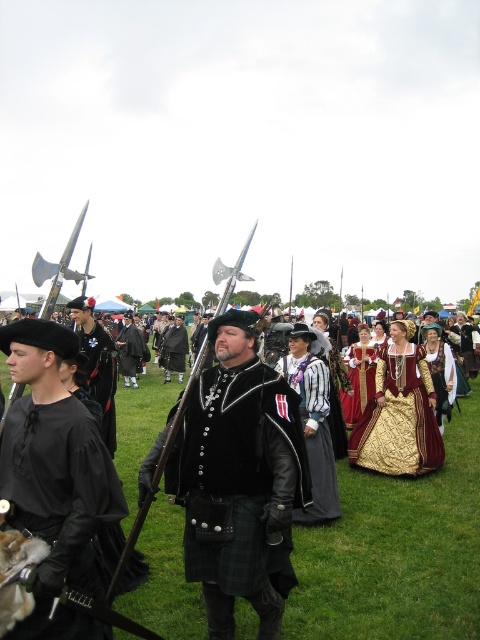
Is the position of striped fabric dress at center less distant than that of gold brocade dress at center?

Yes, it is.

Can you confirm if striped fabric dress at center is positioned to the right of gold brocade dress at center?

Incorrect, striped fabric dress at center is not on the right side of gold brocade dress at center.

Where is `striped fabric dress at center`? The height and width of the screenshot is (640, 480). striped fabric dress at center is located at coordinates (313, 433).

Image resolution: width=480 pixels, height=640 pixels. I want to click on striped fabric dress at center, so click(x=313, y=433).

Image resolution: width=480 pixels, height=640 pixels. I want to click on striped fabric dress at center, so click(313, 433).

Can you confirm if striped fabric dress at center is wider than black velvet hat at center?

Indeed, striped fabric dress at center has a greater width compared to black velvet hat at center.

Who is more distant from viewer, (324,412) or (109,358)?

Positioned behind is point (109,358).

At what (x,y) coordinates should I click in order to perform the action: click on striped fabric dress at center. Please return your answer as a coordinate pair (x, y). Looking at the image, I should click on (313, 433).

Does velvet black vest at center appear under black velvet kilt at center?

Yes.

Who is positioned more to the right, velvet black vest at center or black velvet kilt at center?

velvet black vest at center is more to the right.

I want to click on velvet black vest at center, so click(240, 480).

At what (x,y) coordinates should I click in order to perform the action: click on velvet black vest at center. Please return your answer as a coordinate pair (x, y). Image resolution: width=480 pixels, height=640 pixels. Looking at the image, I should click on (240, 480).